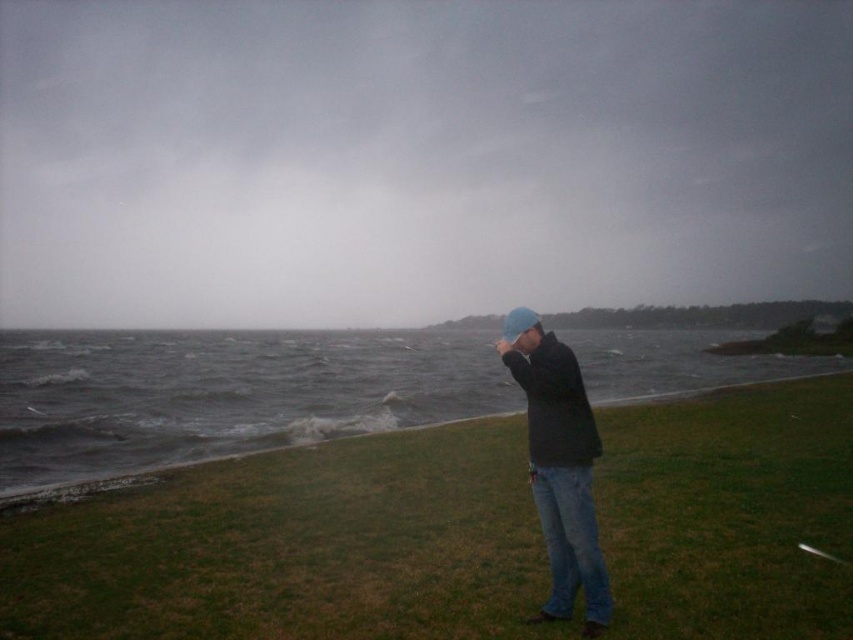
You are planning to set up a small tent for a quick shelter. You have two options for placement based on the scene you see. The first option is on the green grass at lower right, and the second is on the gray water at lower left. Considering the environment described, which location would be more suitable for the tent and why?

The green grass at lower right is shorter than the gray water at lower left. Since tents cannot be placed on water, the green grass at lower right is the suitable location for setting up the tent.

You are standing on the grassy shoreline and want to place a small weatherproof box between the gray water at lower left and the blue knit cap at center. Where should you place it so it doesn t get wet?

You should place the box to the right of the blue knit cap at center since the gray water at lower left is to the left of it, so the right side is farther from the water and less likely to get wet.

You are a photographer trying to capture a dramatic shot of the gray water at lower left and the blue knit cap at center. From your current position, which object is closer to the camera?

The gray water at lower left is positioned under the blue knit cap at center, meaning the blue knit cap at center is closer to the camera than the gray water at lower left.